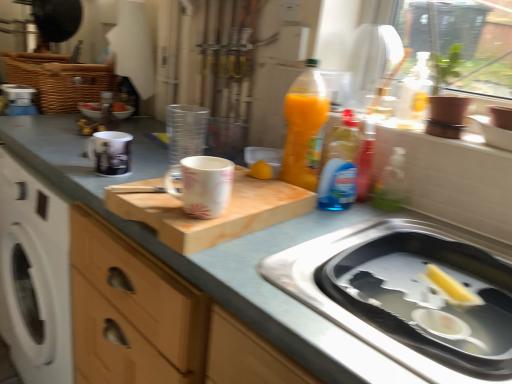
Locate an element on the screen. The image size is (512, 384). free spot to the right of metallic silver bottle at upper center, the second bottle positioned from the bottom is located at coordinates (140, 124).